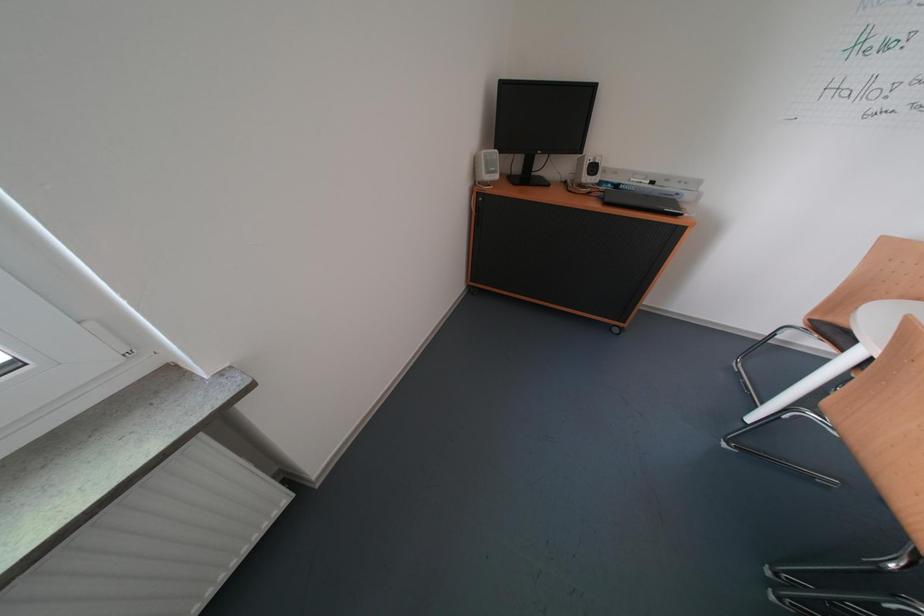
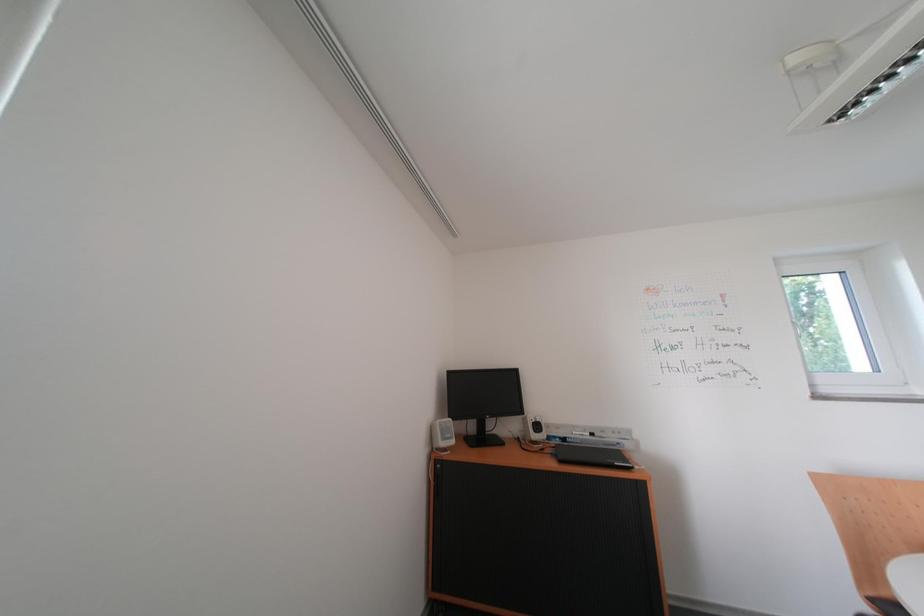
Question: The images are taken continuously from a first-person perspective. In which direction is your viewpoint rotating?

Choices:
 (A) Left
 (B) Right
 (C) Up
 (D) Down

Answer: (C)